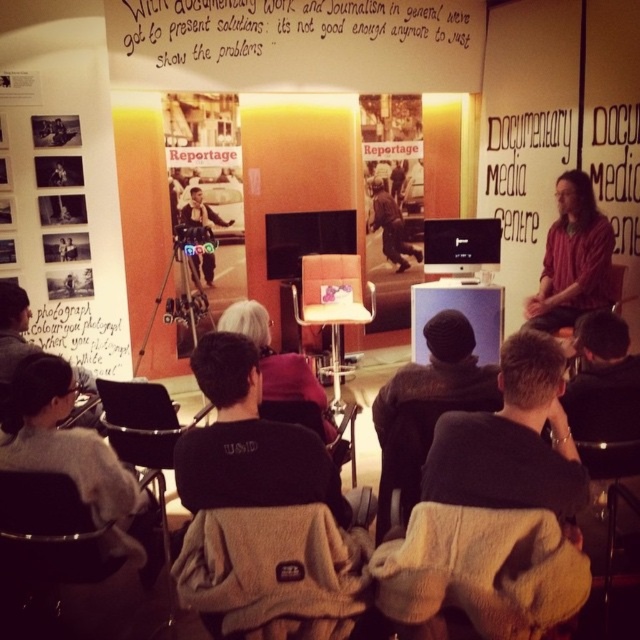
You are a photographer standing at the back of the room. You want to take a closeup shot of the beige fabric chair at lower center. Considering your current position, can you estimate if you need to move closer or farther away to focus properly?

The beige fabric chair at lower center is 4.50 feet away from the camera. Since you are at the back of the room, you need to move closer to the beige fabric chair at lower center to focus properly for a closeup shot.

You are a photographer positioned at the matte black camera at center. You want to adjust the camera to focus on the wooden textured chair at lower right. Considering the distance between them, will you need to use a telephoto lens to capture a closeup shot of the chair?

The wooden textured chair at lower right is 3.60 meters away from the matte black camera at center. A telephoto lens is typically used for capturing distant subjects, so yes, you would need a telephoto lens to get a closeup of the wooden textured chair at lower right from that distance.

You are standing at the entrance of the conference room and want to sit in the beige fabric chair at lower center. According to the coordinates provided, is the chair closer to the front or the back of the room?

The beige fabric chair at lower center is located at point 0.891 on the x and 0.755 on the y, which places it closer to the back of the room since the coordinates are higher on both axes, typically indicating proximity to the back in such setups.